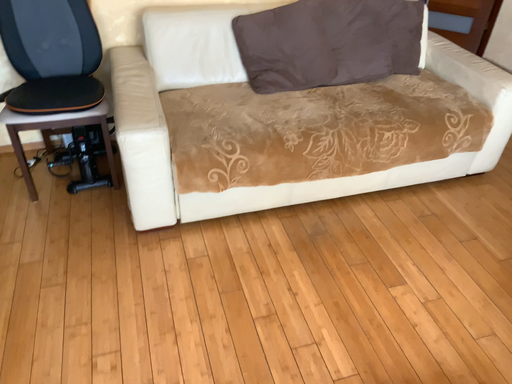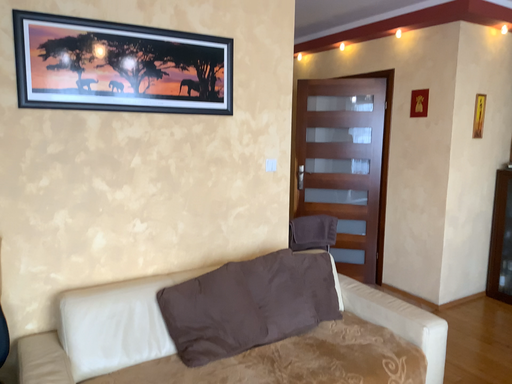
Question: How did the camera likely rotate when shooting the video?

Choices:
 (A) rotated upward
 (B) rotated downward

Answer: (A)